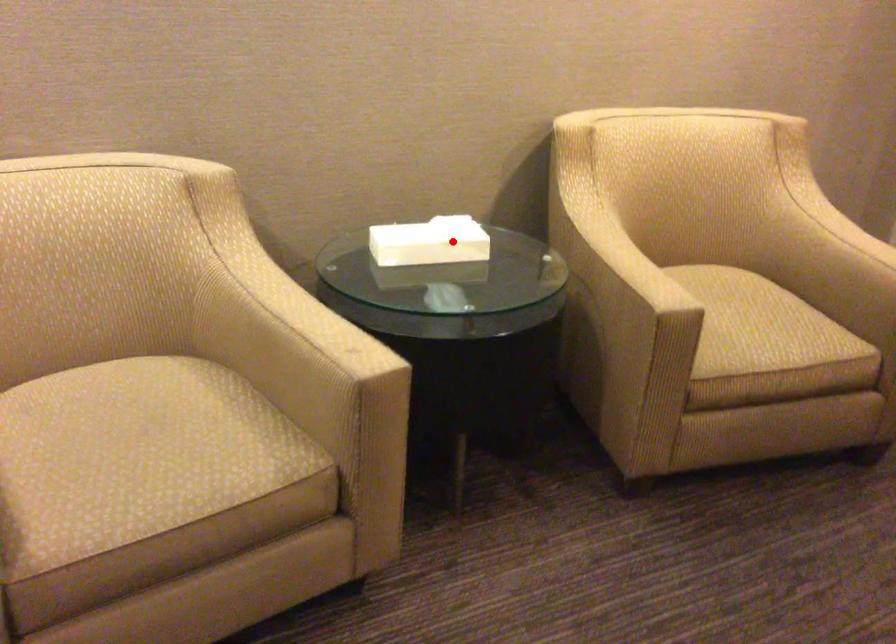
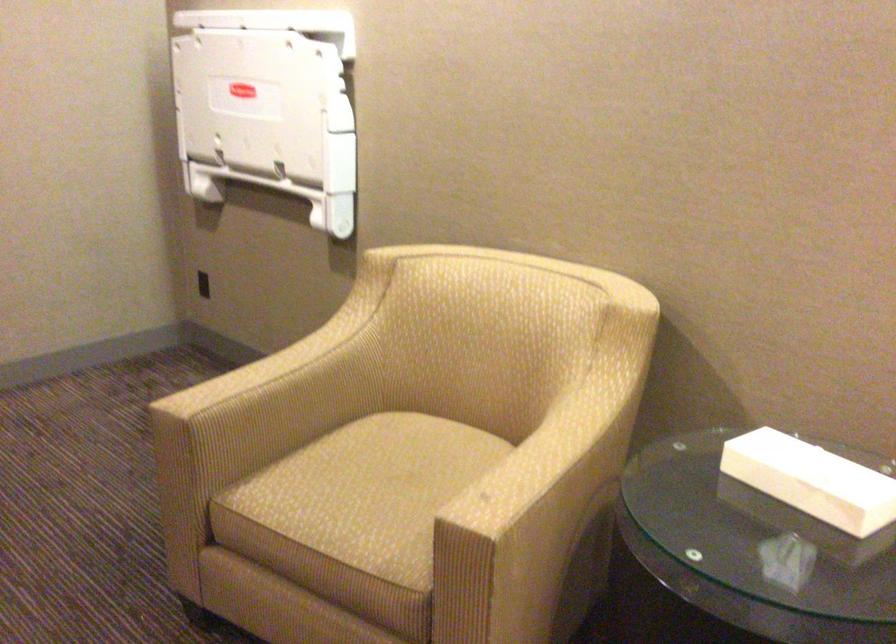
Question: I am providing you with two images of the same scene from different viewpoints. Given a red point in image1, look at the same physical point in image2. Is it:

Choices:
 (A) Closer to the viewpoint
 (B) Farther from the viewpoint

Answer: (A)